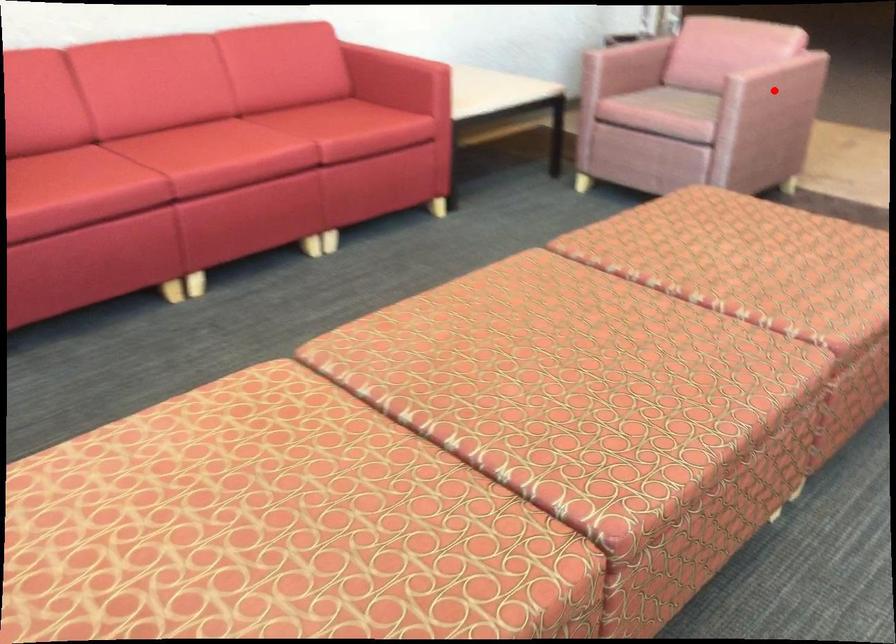
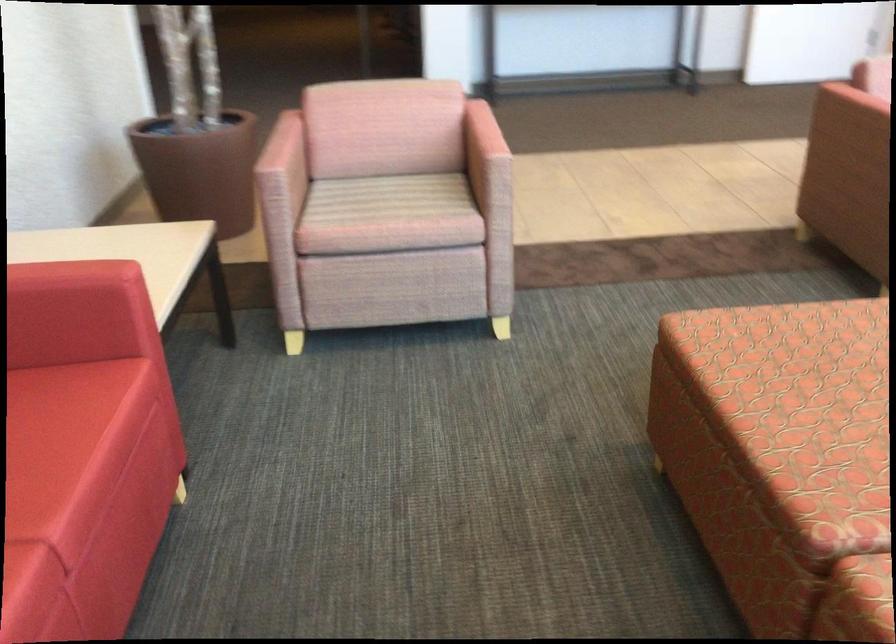
Question: I am providing you with two images of the same scene from different viewpoints. A red point is marked on the first image. Can you still see the location of the red point in image 2?

Choices:
 (A) Yes
 (B) No

Answer: (B)